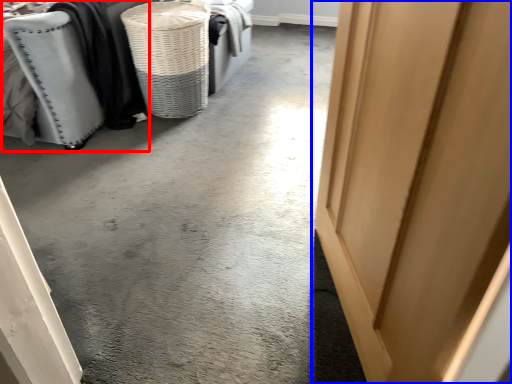
Question: Which of the following is the farthest to the observer, furniture (highlighted by a red box) or door (highlighted by a blue box)?

Choices:
 (A) furniture
 (B) door

Answer: (A)